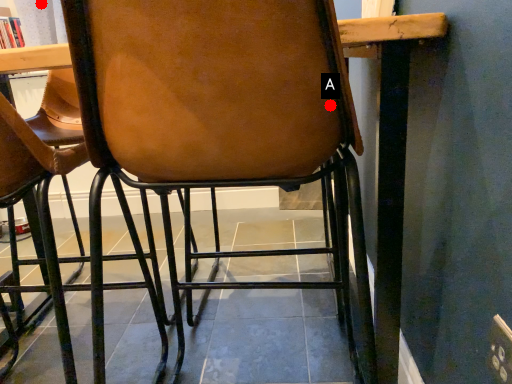
Question: Two points are circled on the image, labeled by A and B beside each circle. Which point appears closest to the camera in this image?

Choices:
 (A) A is closer
 (B) B is closer

Answer: (A)